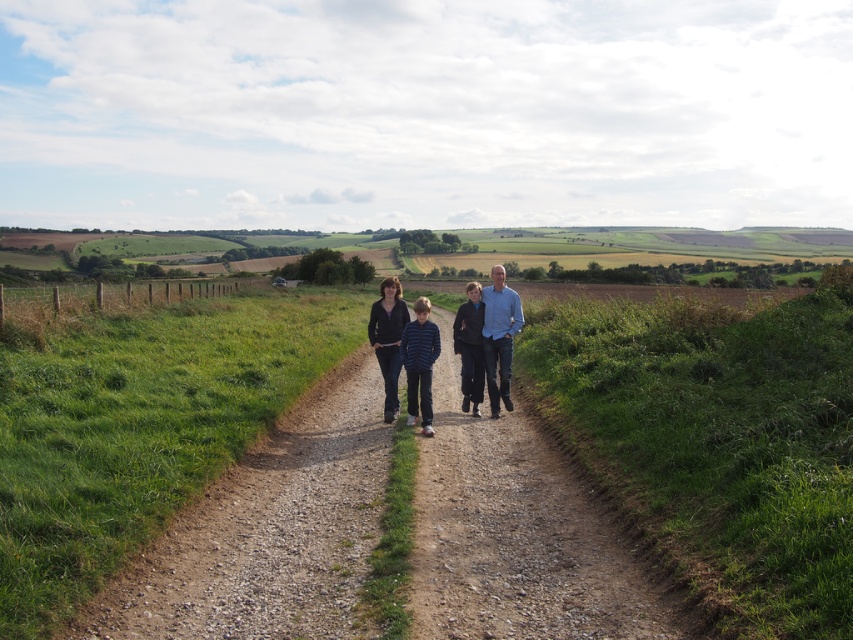
You are a photographer trying to capture a group photo of the two adults and two children walking along the dirt path. You notice the light blue shirt at center and the matte black jacket at center. Which adult should you ask to move closer to the camera to ensure their clothing details are more visible in the photo?

The light blue shirt at center has a smaller width than the matte black jacket at center, so you should ask the adult wearing the light blue shirt at center to move closer to the camera to make their clothing details more visible.

You are a hiker planning to walk along the dirt path in the rural scene. You see two points marked on the path. The first point is at coordinate point (506, 333) and the second point is at coordinate point (390, 317). If you are facing the direction of the path, which point would you encounter first?

Point (390, 317) would be encountered first because point (506, 333) is behind it.

From the picture: You are a photographer standing at the edge of the path. You want to take a photo of the blue denim jeans at center and the matte black jacket at center so that both are in focus. If your camera has a depth of field that can cover 4 feet, will both items be in focus?

The blue denim jeans at center is 3.75 feet away from matte black jacket at center. Since the distance between them is less than 4 feet, both items will be in focus in the photo.